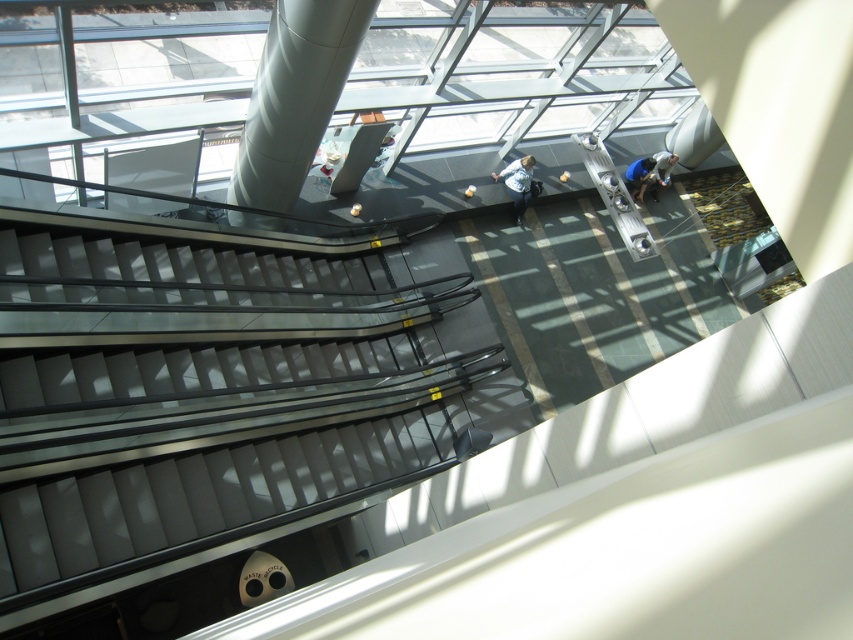
Between satin silver column at center and light blue denim jacket at center, which one has more height?

satin silver column at center

Between satin silver column at center and light blue denim jacket at center, which one appears on the right side from the viewer's perspective?

light blue denim jacket at center

Between point (235, 180) and point (520, 225), which one is positioned in front?

Point (235, 180) is in front.

Where is `satin silver column at center`? satin silver column at center is located at coordinates (294, 97).

Looking at this image, can you confirm if metallic gray escalator at lower left is positioned to the right of satin silver column at center?

Yes, metallic gray escalator at lower left is to the right of satin silver column at center.

Is metallic gray escalator at lower left behind satin silver column at center?

No, it is not.

Between point (146, 355) and point (329, 45), which one is positioned in front?

Point (329, 45)

The width and height of the screenshot is (853, 640). Find the location of `metallic gray escalator at lower left`. metallic gray escalator at lower left is located at coordinates (212, 445).

Does blue fabric shirt at upper right have a smaller size compared to light blue denim jacket at center?

Indeed, blue fabric shirt at upper right has a smaller size compared to light blue denim jacket at center.

Between blue fabric shirt at upper right and light blue denim jacket at center, which one appears on the left side from the viewer's perspective?

Positioned to the left is light blue denim jacket at center.

Who is more forward, (x=654, y=179) or (x=523, y=204)?

Point (x=523, y=204) is in front.

At what (x,y) coordinates should I click in order to perform the action: click on blue fabric shirt at upper right. Please return your answer as a coordinate pair (x, y). Looking at the image, I should click on (648, 173).